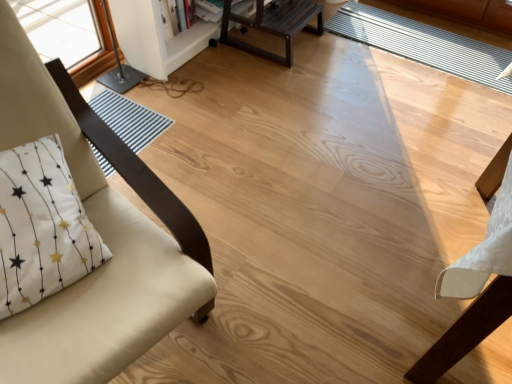
At what (x,y) coordinates should I click in order to perform the action: click on unoccupied area in front of white painted wood bookshelf at upper center. Please return your answer as a coordinate pair (x, y). Image resolution: width=512 pixels, height=384 pixels. Looking at the image, I should click on (208, 99).